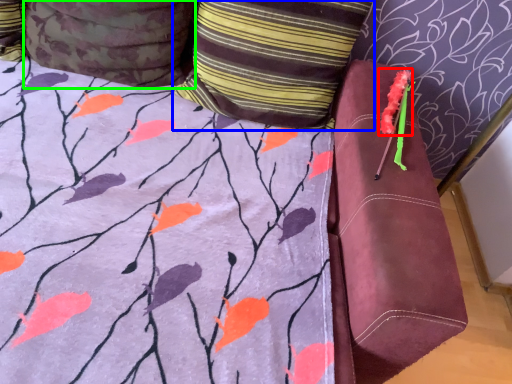
Question: Which is farther away from flower (highlighted by a red box)? pillow (highlighted by a blue box) or pillow (highlighted by a green box)?

Choices:
 (A) pillow
 (B) pillow

Answer: (B)